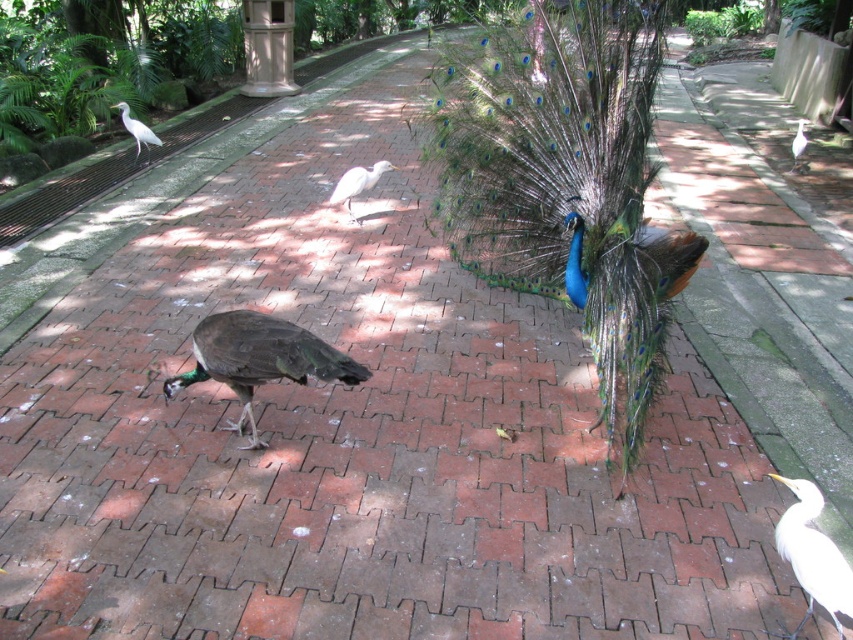
Question: Is white smooth bird at center below white feathered bird at upper right?

Choices:
 (A) no
 (B) yes

Answer: (B)

Question: Can you confirm if shiny blue peacock at center is bigger than white smooth bird at center?

Choices:
 (A) no
 (B) yes

Answer: (A)

Question: Which of the following is the farthest from the observer?

Choices:
 (A) white matte bird at lower right
 (B) shiny blue peacock at center
 (C) white feathered bird at upper right

Answer: (C)

Question: Which object is positioned farthest from the white feathered bird at upper left?

Choices:
 (A) white matte bird at lower right
 (B) shiny blue peacock at center

Answer: (A)

Question: Is white smooth bird at center positioned behind white feathered bird at upper right?

Choices:
 (A) yes
 (B) no

Answer: (B)

Question: Which of the following is the closest to the observer?

Choices:
 (A) (804, 500)
 (B) (376, 163)

Answer: (A)